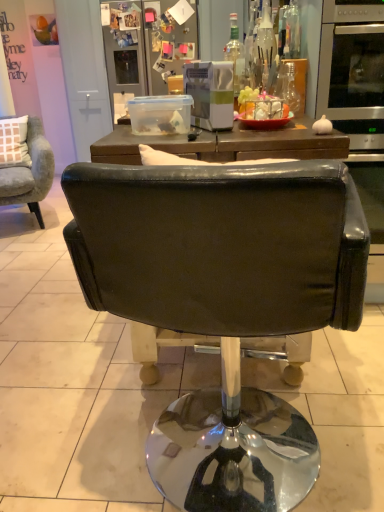
Find the location of `vacant space to the left of black leather chair at center, the second chair positioned from the top`. vacant space to the left of black leather chair at center, the second chair positioned from the top is located at coordinates (61, 426).